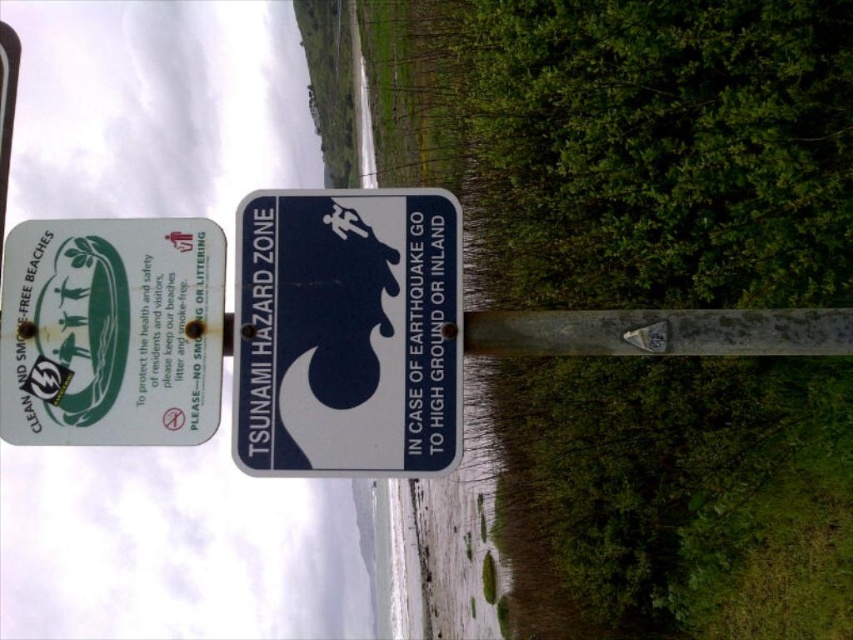
Question: Which object is farther from the camera taking this photo?

Choices:
 (A) white plastic sign at center
 (B) metallic reflective sticker at upper left

Answer: (B)

Question: Which object is closer to the camera taking this photo?

Choices:
 (A) green paper sign at upper left
 (B) metallic reflective sticker at upper left

Answer: (A)

Question: Can you confirm if white plastic sign at center is positioned to the right of green paper sign at upper left?

Choices:
 (A) no
 (B) yes

Answer: (B)

Question: Considering the relative positions of white plastic sign at center and metallic reflective sticker at upper left in the image provided, where is white plastic sign at center located with respect to metallic reflective sticker at upper left?

Choices:
 (A) below
 (B) above

Answer: (B)

Question: Which point is closer to the camera?

Choices:
 (A) (405, 236)
 (B) (201, 336)
 (C) (33, 374)

Answer: (B)

Question: In this image, where is white plastic sign at center located relative to green paper sign at upper left?

Choices:
 (A) below
 (B) above

Answer: (B)